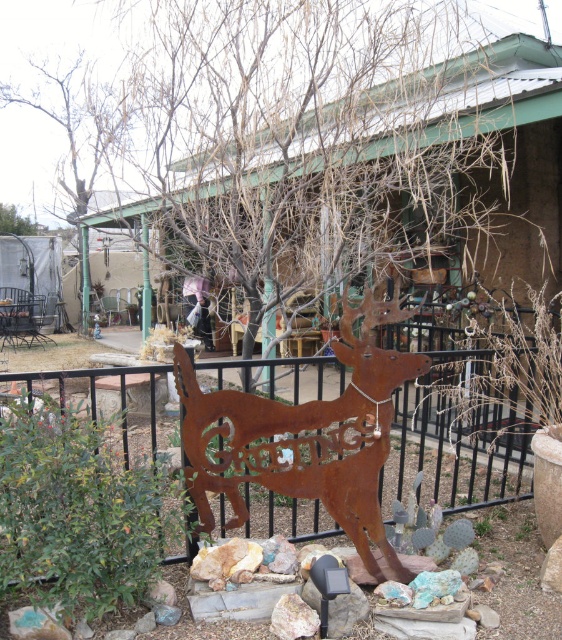
You are planning to place a new bench in this garden scene. The bench needs to be positioned so that it is between the rusty metal deer at center and the brown wood tree at upper left. Is this possible given their current positions?

The rusty metal deer at center is located below the brown wood tree at upper left, so placing the bench between them is possible as they are vertically aligned with the deer lower down and the tree higher up.

You are standing in the garden and want to take a photo of the rusty metal deer at center. Where should you position yourself to capture it in the frame?

The rusty metal deer at center is located at point (x=305, y=435), so you should position yourself facing that coordinate to capture it in the frame.

You are designing a new garden layout and need to know the relative sizes of the rusty metal deer at center and the brown wood tree at upper left. Which object is wider?

The rusty metal deer at center is narrower than the brown wood tree at upper left, so the brown wood tree at upper left is wider.